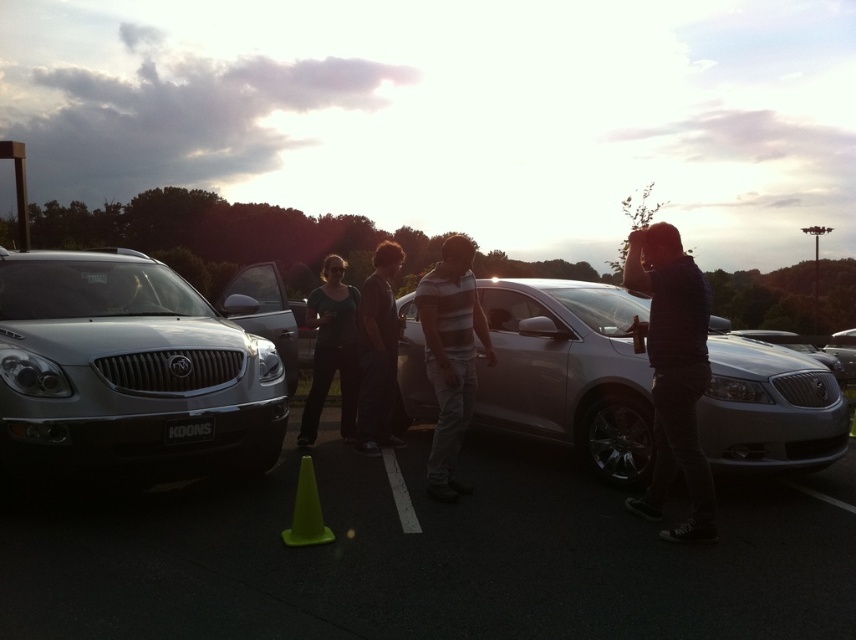
You are standing in the parking lot and want to check the trunk of the satin silver suv at left. Considering your height is 1.7 meters, can you see the trunk without moving closer?

The satin silver suv at left is 4.08 meters away from you. Since the trunk is positioned at the rear of the vehicle and given the average height of the SUV, you might be able to see the trunk from this distance, but it would depend on the SUVs height and the absence of obstructions. However, without specific information about the SUVs height or any obstacles between you and the SUV, it is difficult to determine conclusively.

You are a pedestrian standing in the parking lot and see the dark gray jeans at center and the green plastic traffic cone at lower center. Which object takes up more space in the image?

The dark gray jeans at center has a larger size compared to the green plastic traffic cone at lower center, so it takes up more space in the image.